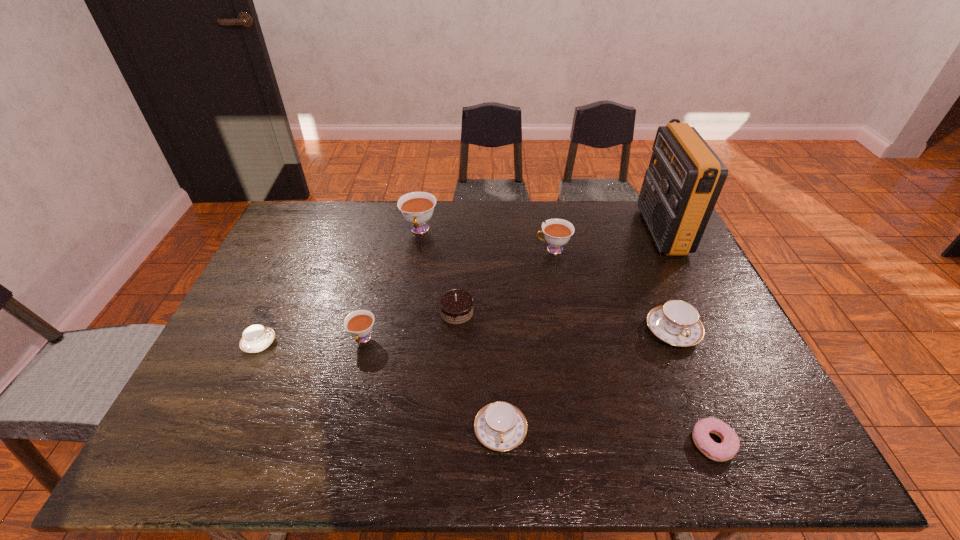
At what (x,y) coordinates should I click in order to perform the action: click on radio receiver. Please return your answer as a coordinate pair (x, y). The height and width of the screenshot is (540, 960). Looking at the image, I should click on (685, 177).

Where is `the second tallest object`? This screenshot has width=960, height=540. the second tallest object is located at coordinates (417, 208).

The height and width of the screenshot is (540, 960). What are the coordinates of `the tallest teacup` in the screenshot? It's located at (417, 208).

Image resolution: width=960 pixels, height=540 pixels. I want to click on the second smallest white teacup, so click(557, 232).

The height and width of the screenshot is (540, 960). Find the location of `the fifth teacup from left to right`. the fifth teacup from left to right is located at coordinates (557, 232).

What are the coordinates of `the rightmost blue teacup` in the screenshot? It's located at (676, 322).

Identify the location of the biggest blue teacup. This screenshot has width=960, height=540. (676, 322).

Where is `chocolate chocolate cake`? The image size is (960, 540). chocolate chocolate cake is located at coordinates (456, 305).

At what (x,y) coordinates should I click in order to perform the action: click on chocolate cake. Please return your answer as a coordinate pair (x, y). The height and width of the screenshot is (540, 960). Looking at the image, I should click on (456, 305).

This screenshot has width=960, height=540. Find the location of `the smallest white teacup`. the smallest white teacup is located at coordinates (359, 323).